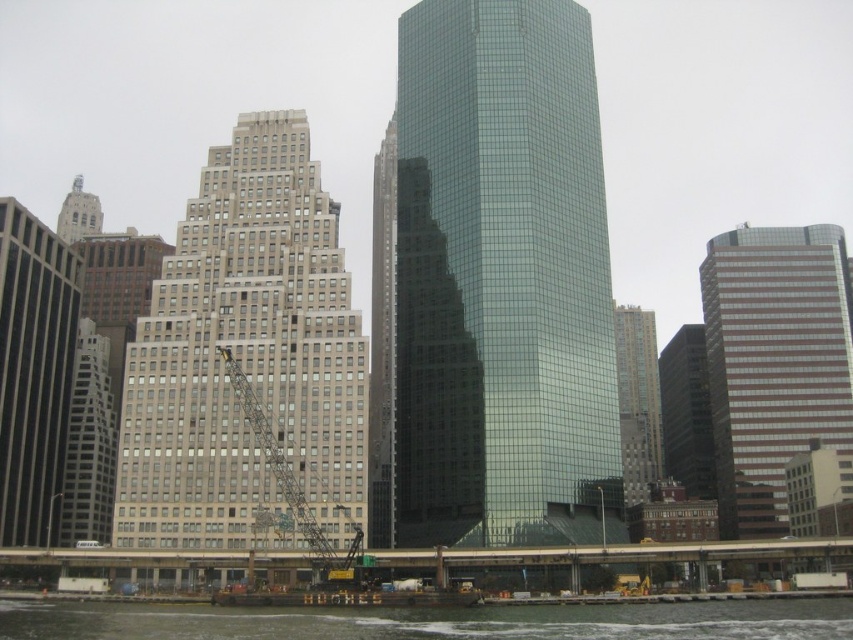
Question: Is gray concrete building at left smaller than dark gray glass building at center?

Choices:
 (A) yes
 (B) no

Answer: (A)

Question: Which of the following is the farthest from the observer?

Choices:
 (A) (82, 214)
 (B) (183, 618)
 (C) (728, 321)

Answer: (A)

Question: Where is clear water at lower center located in relation to gray concrete building at left in the image?

Choices:
 (A) below
 (B) above

Answer: (A)

Question: Which point is closer to the camera taking this photo?

Choices:
 (A) (82, 182)
 (B) (527, 612)
 (C) (137, 458)

Answer: (B)

Question: Which object is the farthest from the shiny glass skyscraper at center?

Choices:
 (A) dark gray concrete skyscraper at left
 (B) glassy brown skyscraper at right
 (C) dark gray glass building at center

Answer: (C)

Question: From the image, what is the correct spatial relationship of glassy brown skyscraper at right in relation to silver metallic spire at upper left?

Choices:
 (A) right
 (B) left

Answer: (A)